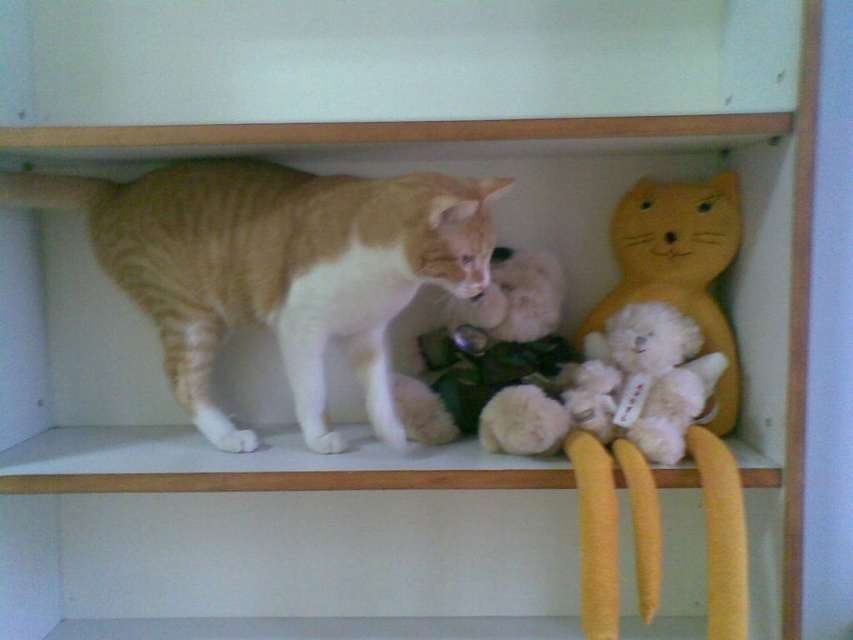
You are a photographer wanting to capture a clear photo of the orange tabby cat at left and the fluffy white teddy bear at center. Which object should you focus on first to ensure both are in focus?

You should focus on the orange tabty cat at left first because it is closer to the viewer than the fluffy white teddy bear at center, so adjusting focus from near to far will help both be in focus.

You are a toy collector who wants to place a new 4 inch tall stuffed animal between the two fluffy white teddy bears on the shelf. Based on the image, will there be enough space between the fluffy white teddy bear at center and the fluffy white teddy bear at right to fit your new toy?

The distance between the fluffy white teddy bear at center and the fluffy white teddy bear at right is 3.84 inches. Since the new stuffed animal is 4 inches tall, it will not fit in the space between them.